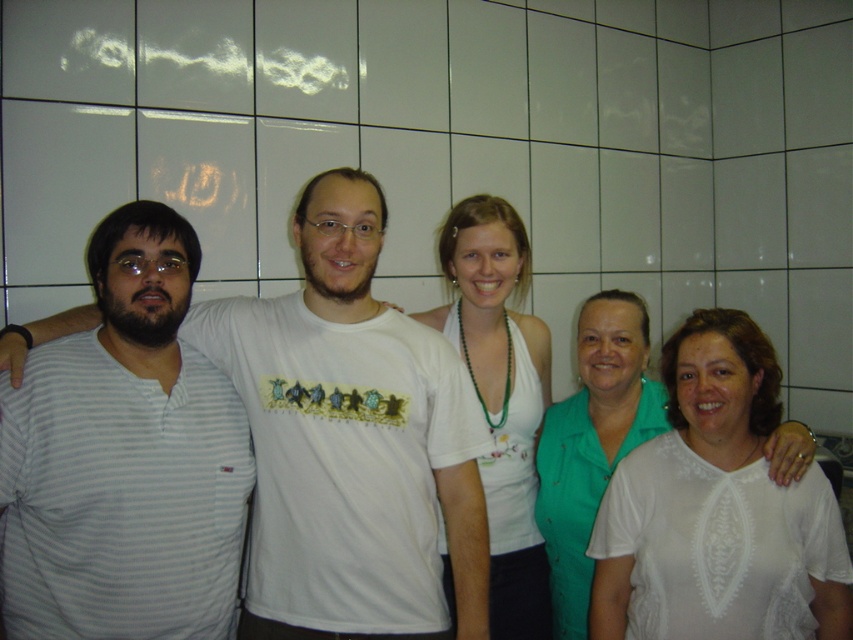
Who is lower down, striped cotton shirt at left or white fabric top at center?

white fabric top at center is below.

Measure the distance between striped cotton shirt at left and white fabric top at center.

striped cotton shirt at left and white fabric top at center are 24.46 inches apart from each other.

The width and height of the screenshot is (853, 640). Describe the element at coordinates (125, 458) in the screenshot. I see `striped cotton shirt at left` at that location.

Locate an element on the screen. This screenshot has width=853, height=640. striped cotton shirt at left is located at coordinates (125, 458).

How far apart are striped cotton shirt at left and gray striped shirt at left?

striped cotton shirt at left is 20.21 centimeters away from gray striped shirt at left.

Can you confirm if striped cotton shirt at left is positioned to the right of gray striped shirt at left?

No, striped cotton shirt at left is not to the right of gray striped shirt at left.

The height and width of the screenshot is (640, 853). I want to click on striped cotton shirt at left, so click(125, 458).

Is white lace blouse at center thinner than gray striped shirt at left?

Indeed, white lace blouse at center has a lesser width compared to gray striped shirt at left.

Can you confirm if white lace blouse at center is positioned to the left of gray striped shirt at left?

In fact, white lace blouse at center is to the right of gray striped shirt at left.

Describe the element at coordinates (592, 444) in the screenshot. I see `white lace blouse at center` at that location.

Image resolution: width=853 pixels, height=640 pixels. What are the coordinates of `white lace blouse at center` in the screenshot? It's located at (592, 444).